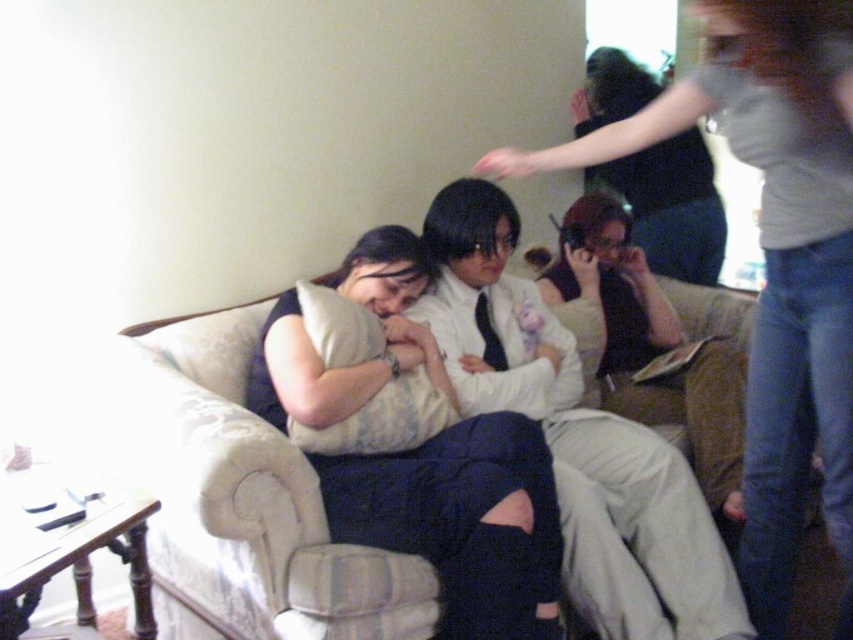
Does beige fabric couch at center have a smaller size compared to white soft pillow at center?

Actually, beige fabric couch at center might be larger than white soft pillow at center.

The image size is (853, 640). What do you see at coordinates (241, 492) in the screenshot?
I see `beige fabric couch at center` at bounding box center [241, 492].

Does point (735, 314) lie in front of point (412, 420)?

No, it is not.

In order to click on beige fabric couch at center in this screenshot , I will do `click(241, 492)`.

Based on the photo, who is positioned more to the right, matte white shirt at upper right or matte black shirt at center?

Positioned to the right is matte white shirt at upper right.

Between point (845, 547) and point (271, 388), which one is positioned in front?

Point (845, 547) is more forward.

Looking at this image, who is more forward, [810,176] or [482,608]?

Point [810,176]

I want to click on matte white shirt at upper right, so click(x=772, y=260).

Does matte white shirt at upper right have a lesser width compared to white soft pillow at center?

No.

Which is more to the left, matte white shirt at upper right or white soft pillow at center?

white soft pillow at center

Which is in front, point (830, 48) or point (317, 442)?

Point (830, 48) is more forward.

Where is `matte white shirt at upper right`? matte white shirt at upper right is located at coordinates (772, 260).